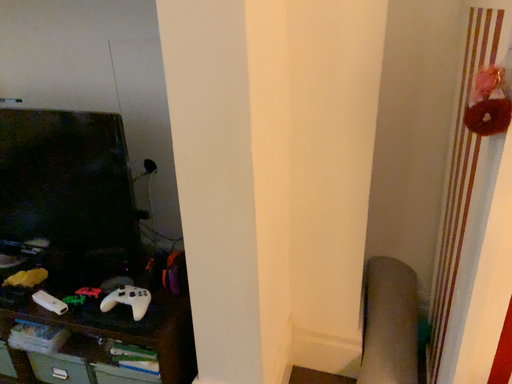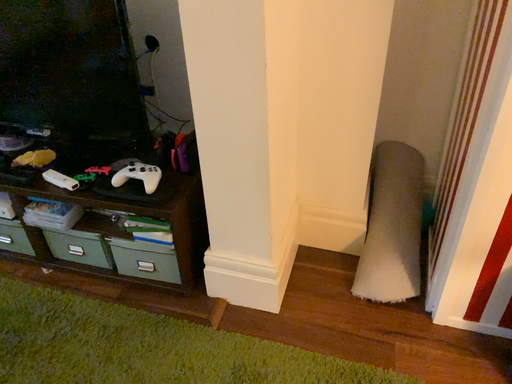
Question: Which way did the camera rotate in the video?

Choices:
 (A) rotated upward
 (B) rotated downward

Answer: (B)